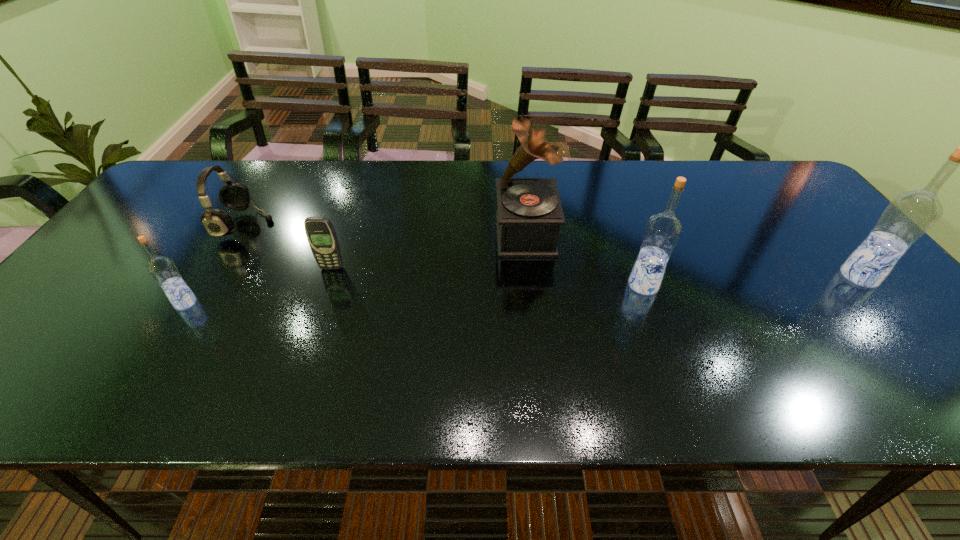
Locate an element on the screen. Image resolution: width=960 pixels, height=540 pixels. vacant space that satisfies the following two spatial constraints: 1. on the back side of the fifth object from left to right; 2. at the horn opening of the third object from right to left is located at coordinates (625, 234).